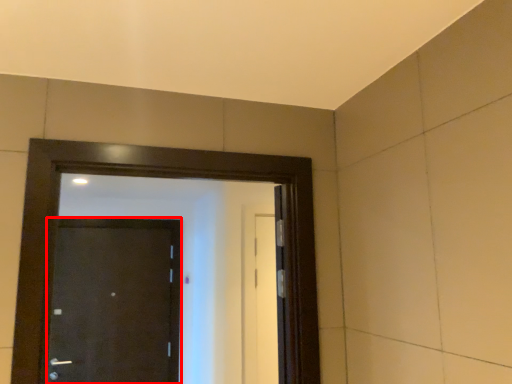
Question: From the image's perspective, considering the relative positions of door (annotated by the red box) and door in the image provided, where is door (annotated by the red box) located with respect to the staircase?

Choices:
 (A) below
 (B) above

Answer: (A)